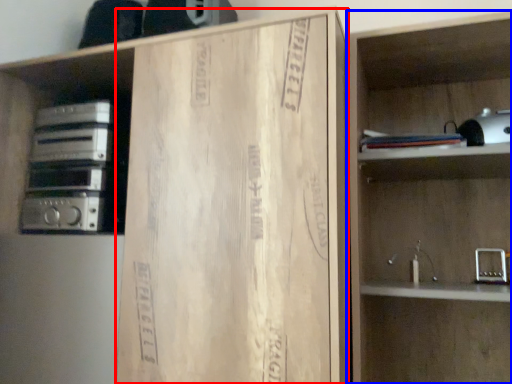
Question: Which object is further to the camera taking this photo, cardboard (highlighted by a red box) or shelf (highlighted by a blue box)?

Choices:
 (A) cardboard
 (B) shelf

Answer: (B)